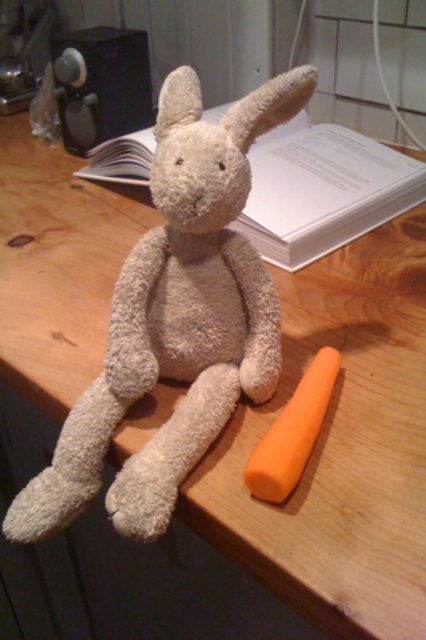
Which is behind, point (103, 141) or point (256, 493)?

Positioned behind is point (103, 141).

Is point (287, 195) behind point (273, 468)?

Yes.

Which is in front, point (267, 225) or point (313, 381)?

Point (313, 381) is in front.

Where is `white paper at upper center`? The image size is (426, 640). white paper at upper center is located at coordinates (322, 189).